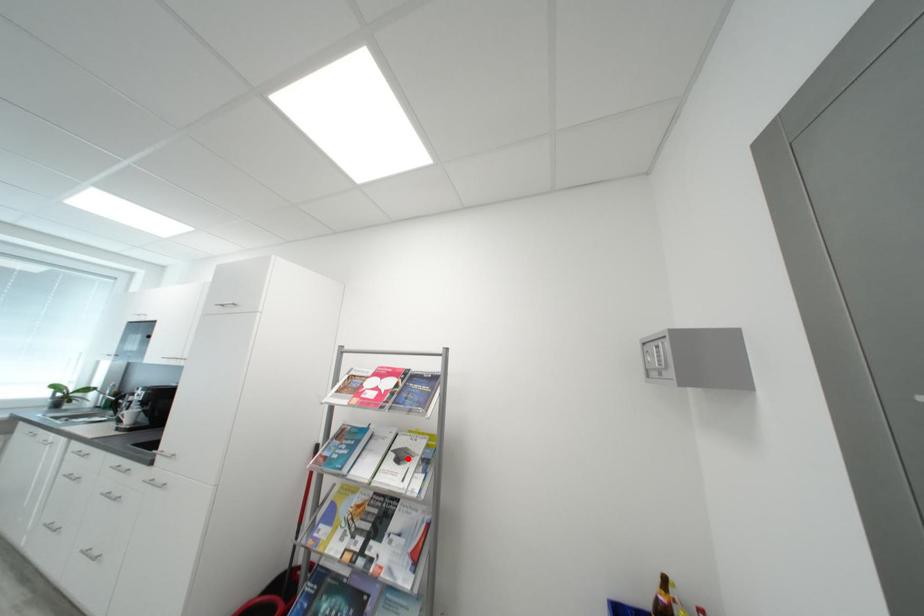
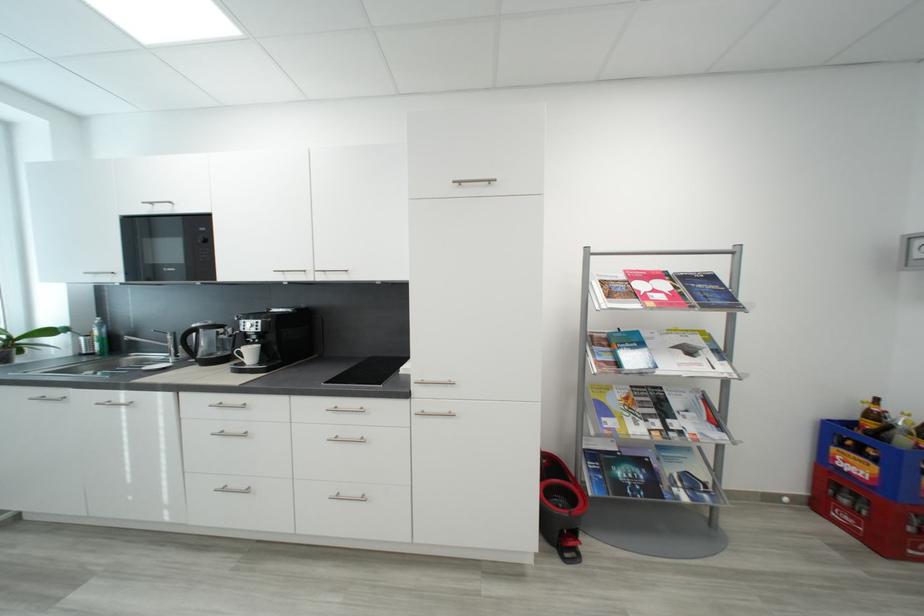
The point at the highlighted location is marked in the first image. Where is the corresponding point in the second image?

(697, 353)